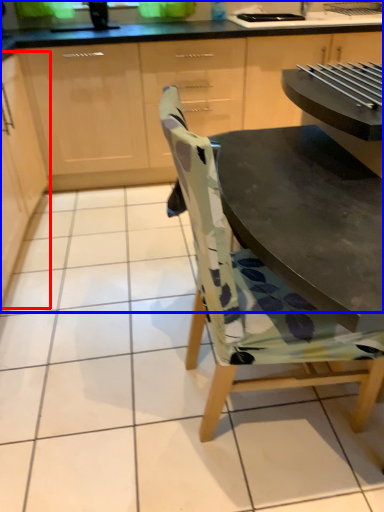
Question: Which object is closer to the camera taking this photo, cabinetry (highlighted by a red box) or cabinetry (highlighted by a blue box)?

Choices:
 (A) cabinetry
 (B) cabinetry

Answer: (A)